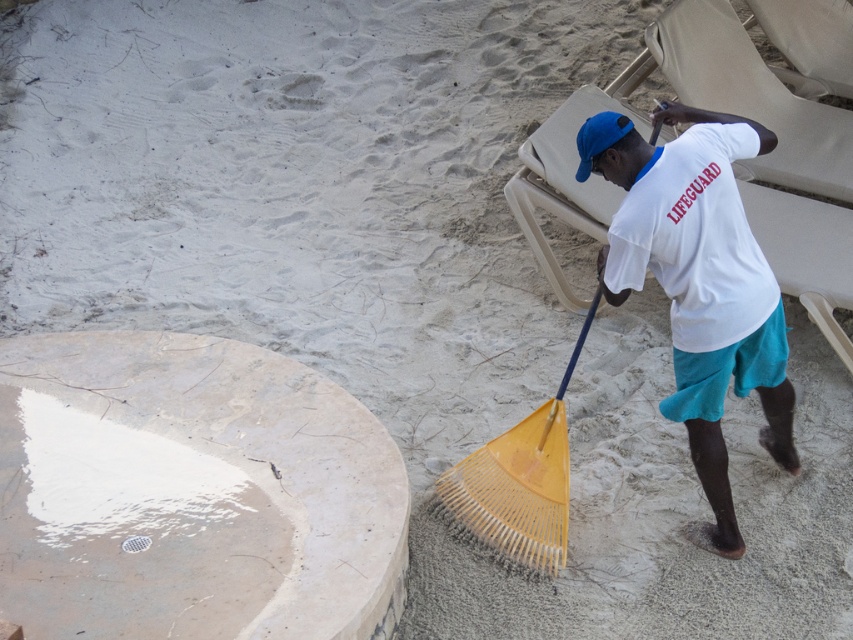
You are a lifeguard on duty and need to place a 1.2 meter long safety rope between the white marble cement at lower left and the blue fabric baseball cap at upper center. Considering their positions and sizes, will the rope reach both objects without needing to adjust their positions?

The white marble cement at lower left is taller than the blue fabric baseball cap at upper center, but the question is about the distance between them. The provided information does not include the distance between the two objects, so it cannot be determined if the 1.2 meter rope will reach. Additional measurements are needed.

You are a lifeguard on duty and notice a small child wandering near the edge of the water. You need to quickly reach them before they get too close to the water. The child is standing at the point marked by point (190, 492). Which direction should you move from your current position at the white T shirt with red letters on the back to reach the child as quickly as possible?

The point (190, 492) marks white marble cement at lower left. Since the lifeguard is at the white T shirt with red letters on the back, which is the lifeguard themselves, they should move towards the lower left direction to reach the child quickly.

You are a lifeguard on duty and need to move a first aid kit from the white marble cement at lower left to the beige fabric beach chair at upper right. Which direction should you move it?

The white marble cement at lower left is to the left of the beige fabric beach chair at upper right, so you should move the first aid kit to the right direction.